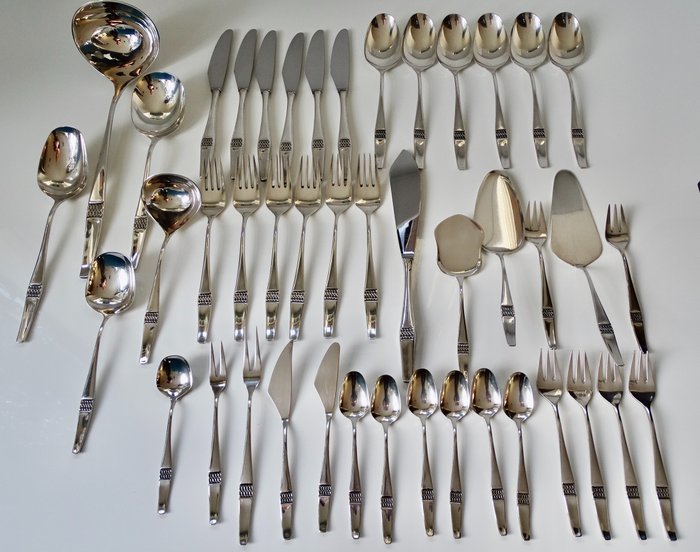
What are the coordinates of `cocktail forks` in the screenshot? It's located at (554, 388), (582, 392), (615, 391), (640, 387).